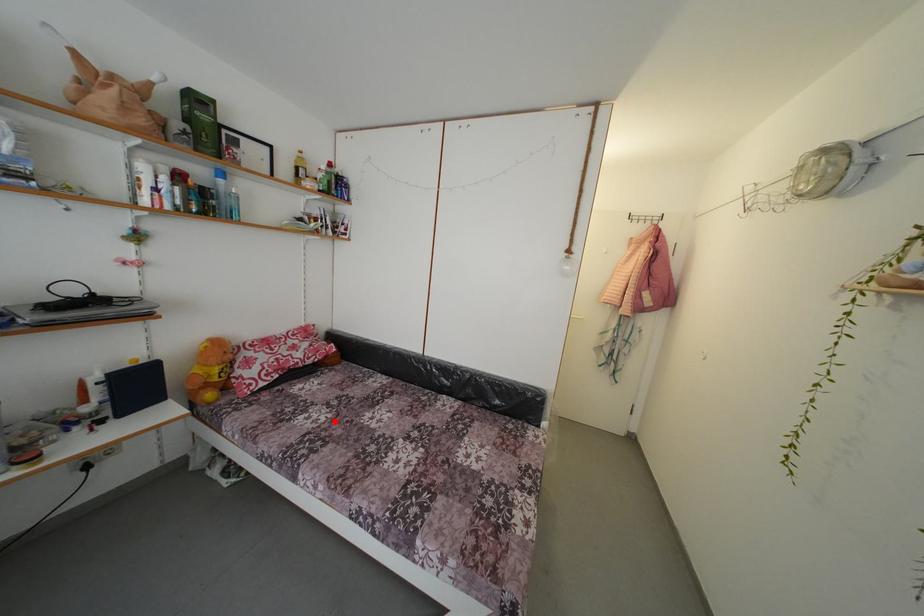
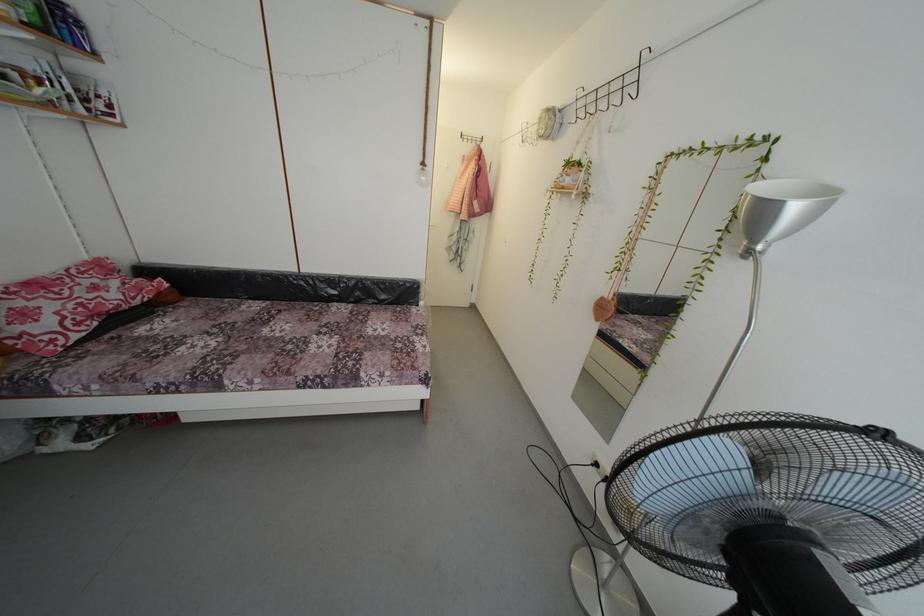
Find the pixel in the second image that matches the highlighted location in the first image.

(225, 345)